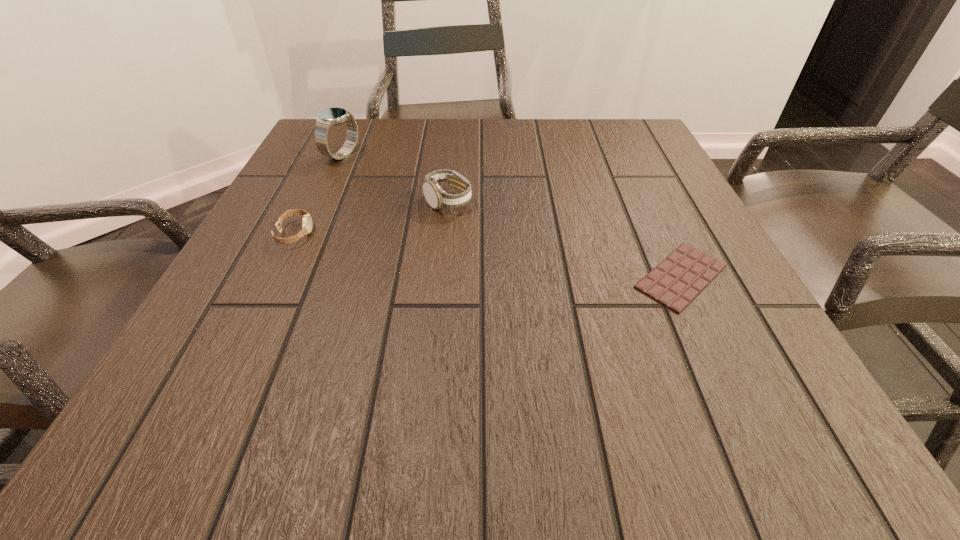
Locate an element on the screen. vacant area in the image that satisfies the following two spatial constraints: 1. on the back side of the chocolate bar; 2. on the face of the nearest watch is located at coordinates (660, 234).

This screenshot has width=960, height=540. I want to click on vacant area in the image that satisfies the following two spatial constraints: 1. on the face of the second tallest watch; 2. on the left side of the chocolate bar, so click(x=441, y=276).